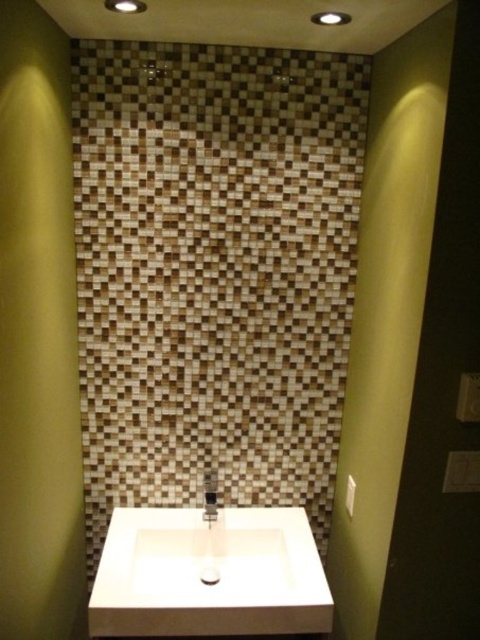
You are a plumber trying to fix a leak under the sink. You need to reach the brown mosaic tile at center and the satin nickel faucet at center. Which object is closer to you?

The brown mosaic tile at center is 20.19 inches away from the satin nickel faucet at center. Since both objects are at center, they are equidistant from you.

You are standing in the bathroom and want to turn on the water. The white matte sink at center and the satin nickel faucet at center are in your view. Which object should you interact with to control the water flow?

You should interact with the satin nickel faucet at center to control the water flow, as it is the faucet responsible for regulating the water.